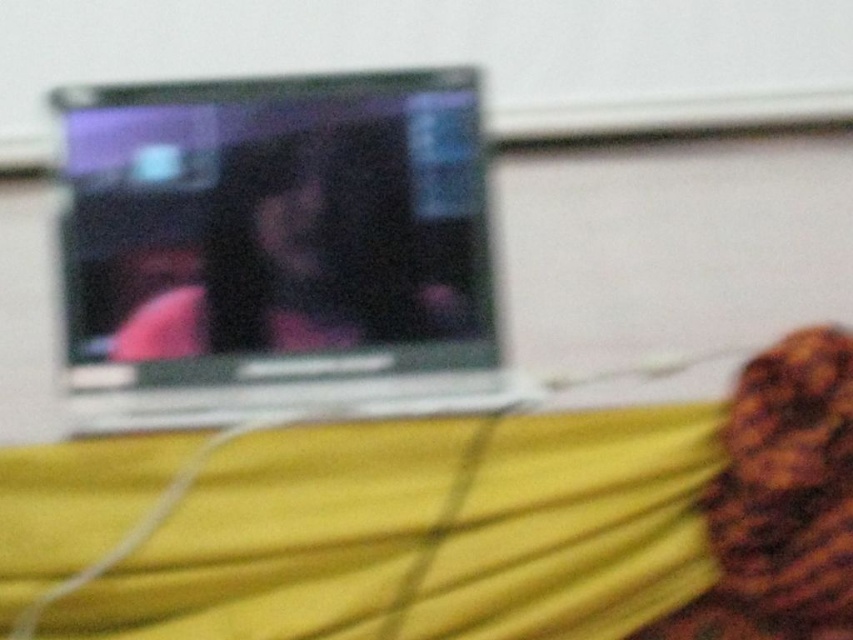
You are organizing items in a room and need to place the yellow fabric at lower center and the silver metallic laptop at upper center. Based on their positions, which object is closer to the bottom edge of the room?

The yellow fabric at lower center is closer to the bottom edge of the room because it is located below the silver metallic laptop at upper center.

You are standing in front of the scene and want to pick up the yellow fabric at lower center and the silver metallic laptop at upper center. Which object will require you to reach further to pick up?

The silver metallic laptop at upper center requires reaching further because it is farther from the viewer compared to the yellow fabric at lower center.